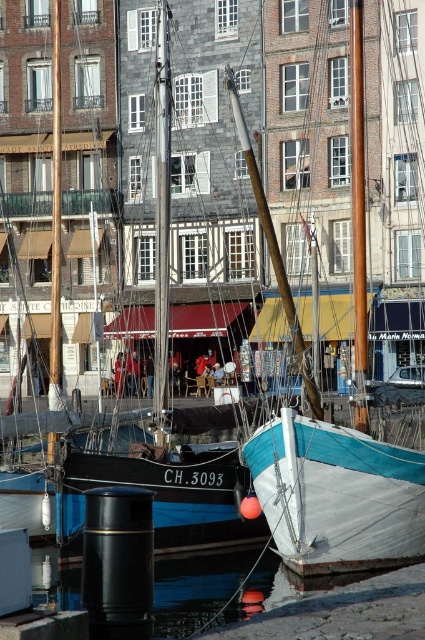
You are a dock worker who needs to ensure that the teal canvas sailboat at center and the brown polished wood mast at center can fit through a narrow passage that is exactly the width of the mast. Based on the scene description, will both objects fit through the passage?

The teal canvas sailboat at center is wider than the brown polished wood mast at center. Since the passage is exactly the width of the mast, the teal canvas sailboat at center will not fit through the passage, but the mast will.

You are a dock worker who needs to secure a 6 feet long safety rope between the teal canvas sailboat at center and the brown polished wood mast at center. Based on the scene, will the rope be long enough?

The teal canvas sailboat at center and brown polished wood mast at center are 5.93 feet apart. The 6 feet long safety rope is slightly longer than the distance between them, so it will be long enough to secure between the teal canvas sailboat at center and the brown polished wood mast at center.